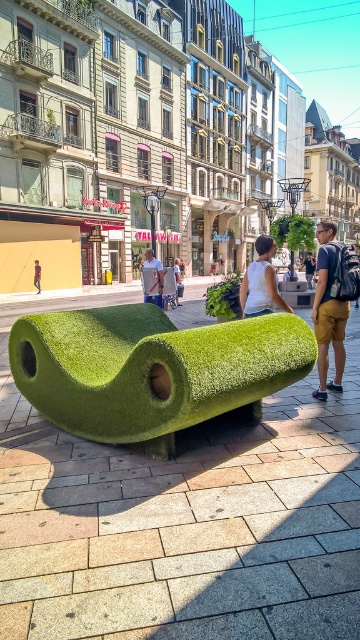
Question: Estimate the real-world distances between objects in this image. Which object is farther from the white cotton t-shirt at center?

Choices:
 (A) khaki cotton shorts at lower right
 (B) green grass bench at center
 (C) green tufted bench at center

Answer: (C)

Question: Can you confirm if green grass bench at center is thinner than green tufted bench at center?

Choices:
 (A) no
 (B) yes

Answer: (A)

Question: Does khaki cotton shorts at lower right lie behind white fabric shirt at center?

Choices:
 (A) yes
 (B) no

Answer: (A)

Question: Can you confirm if green grass bench at center is positioned below green tufted bench at center?

Choices:
 (A) no
 (B) yes

Answer: (A)

Question: Which of the following is the farthest from the observer?

Choices:
 (A) (351, 257)
 (B) (149, 252)

Answer: (B)

Question: Which of the following is the closest to the observer?

Choices:
 (A) green tufted bench at center
 (B) green grass bench at center
 (C) white fabric shirt at center

Answer: (B)